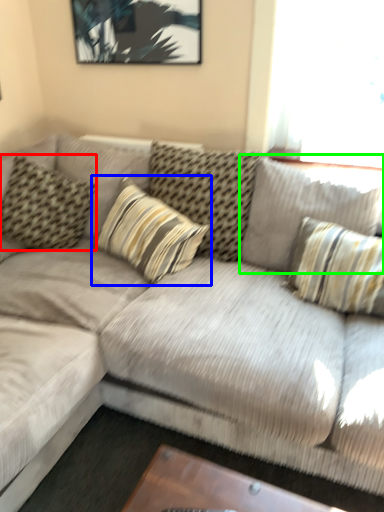
Question: Estimate the real-world distances between objects in this image. Which object is closer to pillow (highlighted by a red box), pillow (highlighted by a blue box) or pillow (highlighted by a green box)?

Choices:
 (A) pillow
 (B) pillow

Answer: (A)